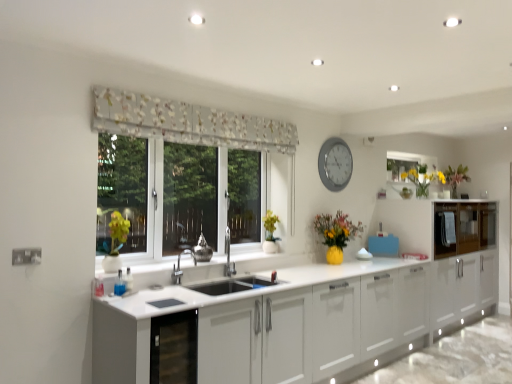
Question: Is floral fabric curtain at upper center bigger than glossy wood cabinets at right?

Choices:
 (A) yes
 (B) no

Answer: (B)

Question: Does floral fabric curtain at upper center appear on the left side of glossy wood cabinets at right?

Choices:
 (A) no
 (B) yes

Answer: (B)

Question: Does floral fabric curtain at upper center have a lesser width compared to glossy wood cabinets at right?

Choices:
 (A) yes
 (B) no

Answer: (A)

Question: Does floral fabric curtain at upper center have a smaller size compared to glossy wood cabinets at right?

Choices:
 (A) no
 (B) yes

Answer: (B)

Question: From a real-world perspective, is floral fabric curtain at upper center physically above glossy wood cabinets at right?

Choices:
 (A) yes
 (B) no

Answer: (A)

Question: From their relative heights in the image, would you say silver metallic clock at upper center is taller or shorter than green matte plant at left?

Choices:
 (A) tall
 (B) short

Answer: (A)

Question: In terms of size, does silver metallic clock at upper center appear bigger or smaller than green matte plant at left?

Choices:
 (A) big
 (B) small

Answer: (A)

Question: From a real-world perspective, is silver metallic clock at upper center physically located above or below green matte plant at left?

Choices:
 (A) below
 (B) above

Answer: (B)

Question: Is silver metallic clock at upper center inside the boundaries of green matte plant at left, or outside?

Choices:
 (A) outside
 (B) inside

Answer: (A)

Question: In terms of size, does green matte plant at left appear bigger or smaller than glossy wood cabinets at right?

Choices:
 (A) small
 (B) big

Answer: (A)

Question: In terms of width, does green matte plant at left look wider or thinner when compared to glossy wood cabinets at right?

Choices:
 (A) thin
 (B) wide

Answer: (A)

Question: From their relative heights in the image, would you say green matte plant at left is taller or shorter than glossy wood cabinets at right?

Choices:
 (A) short
 (B) tall

Answer: (A)

Question: From a real-world perspective, is green matte plant at left above or below glossy wood cabinets at right?

Choices:
 (A) above
 (B) below

Answer: (A)

Question: From the image's perspective, is green matte plant at left positioned above or below floral fabric curtain at upper center?

Choices:
 (A) above
 (B) below

Answer: (B)

Question: In terms of size, does green matte plant at left appear bigger or smaller than floral fabric curtain at upper center?

Choices:
 (A) big
 (B) small

Answer: (B)